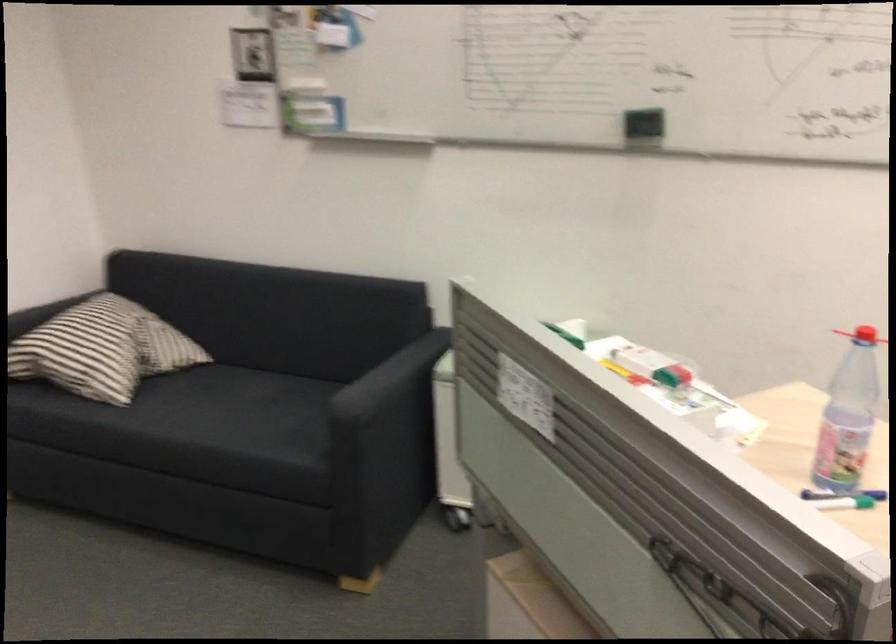
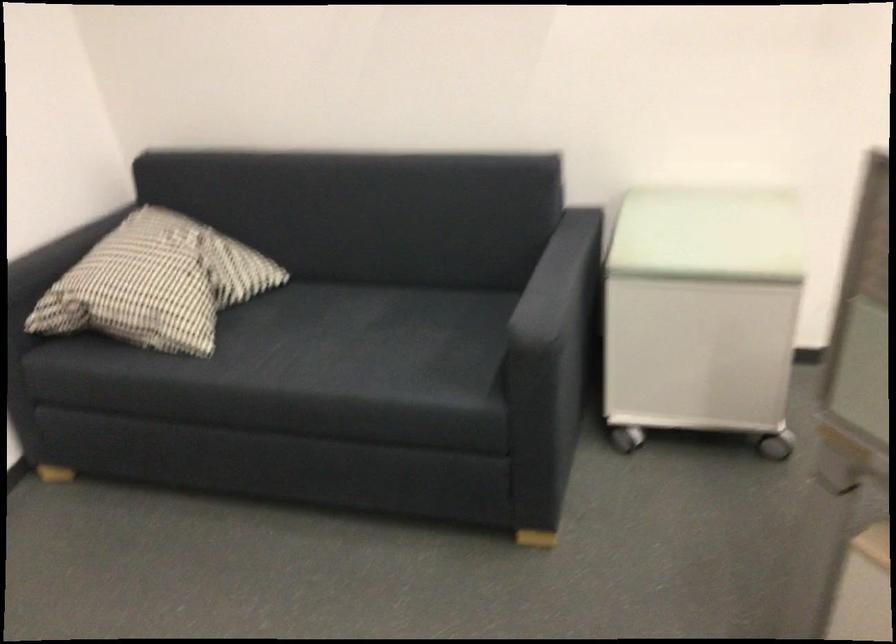
Where in the second image is the point corresponding to the point at 288,404 from the first image?

(410, 327)